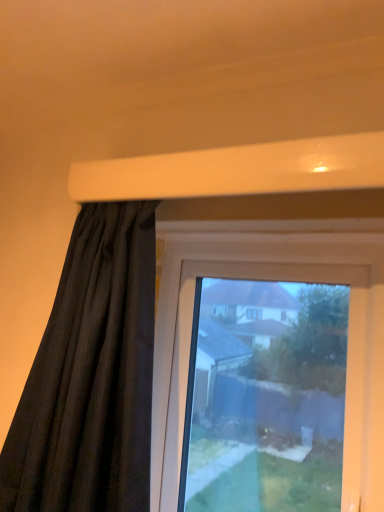
At what (x,y) coordinates should I click in order to perform the action: click on dark brown fabric at upper left. Please return your answer as a coordinate pair (x, y). This screenshot has height=512, width=384. Looking at the image, I should click on [91, 375].

Measure the distance between point (121, 283) and camera.

Point (121, 283) and camera are 35.51 inches apart from each other.

This screenshot has height=512, width=384. Describe the element at coordinates (91, 375) in the screenshot. I see `dark brown fabric at upper left` at that location.

Where is `dark brown fabric at upper left`? The image size is (384, 512). dark brown fabric at upper left is located at coordinates click(91, 375).